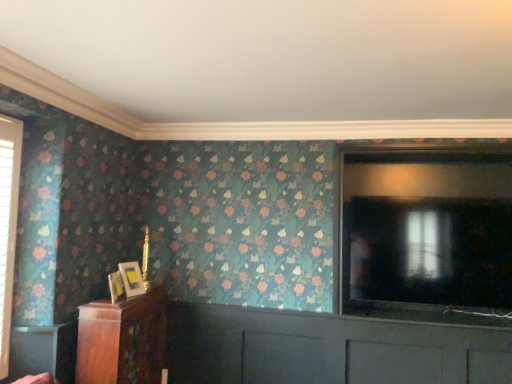
Question: Is transparent glass screen door at right not within wooden cabinet at lower left?

Choices:
 (A) no
 (B) yes

Answer: (B)

Question: Is transparent glass screen door at right facing away from wooden cabinet at lower left?

Choices:
 (A) no
 (B) yes

Answer: (A)

Question: Are transparent glass screen door at right and wooden cabinet at lower left located far from each other?

Choices:
 (A) no
 (B) yes

Answer: (B)

Question: From a real-world perspective, does transparent glass screen door at right stand above wooden cabinet at lower left?

Choices:
 (A) no
 (B) yes

Answer: (B)

Question: Considering the relative sizes of transparent glass screen door at right and wooden cabinet at lower left in the image provided, is transparent glass screen door at right taller than wooden cabinet at lower left?

Choices:
 (A) yes
 (B) no

Answer: (A)

Question: From the image's perspective, is transparent glass screen door at right located beneath wooden cabinet at lower left?

Choices:
 (A) no
 (B) yes

Answer: (A)

Question: Is wooden table at lower left thinner than matte gold picture frame at left, the 1th picture frame positioned from the front?

Choices:
 (A) no
 (B) yes

Answer: (B)

Question: Is wooden table at lower left to the right of matte gold picture frame at left, the second picture frame positioned from the back, from the viewer's perspective?

Choices:
 (A) no
 (B) yes

Answer: (A)

Question: Can you confirm if wooden table at lower left is taller than matte gold picture frame at left, the 1th picture frame positioned from the front?

Choices:
 (A) no
 (B) yes

Answer: (B)

Question: Would you say wooden table at lower left contains matte gold picture frame at left, the 1th picture frame positioned from the front?

Choices:
 (A) no
 (B) yes

Answer: (A)

Question: Is wooden table at lower left not inside matte gold picture frame at left, the 1th picture frame positioned from the front?

Choices:
 (A) no
 (B) yes

Answer: (B)

Question: Considering the relative positions of wooden table at lower left and matte gold picture frame at left, the 1th picture frame positioned from the front, in the image provided, is wooden table at lower left in front of matte gold picture frame at left, the 1th picture frame positioned from the front,?

Choices:
 (A) no
 (B) yes

Answer: (B)

Question: Is wooden table at lower left located outside wooden cabinet at lower left?

Choices:
 (A) yes
 (B) no

Answer: (A)